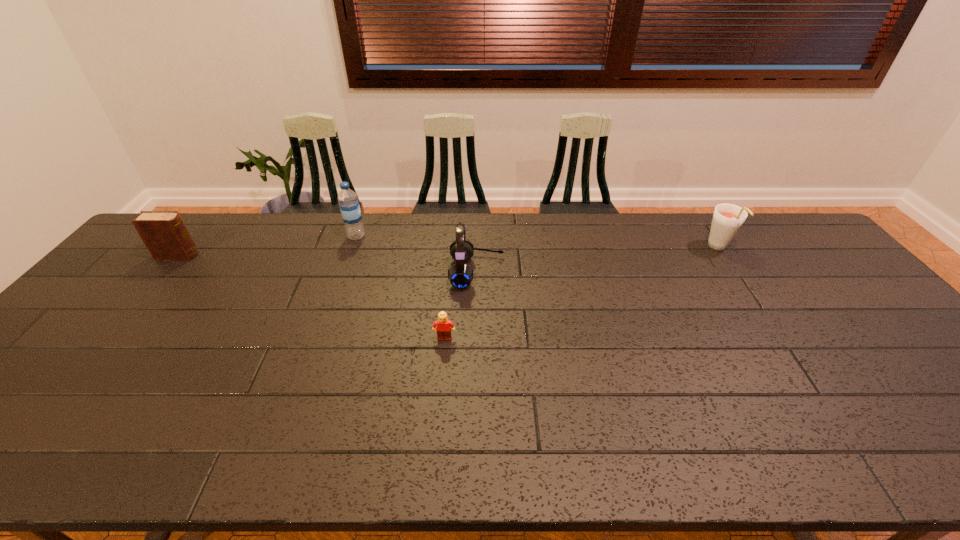
At what (x,y) coordinates should I click in order to perform the action: click on vacant space that is in between the diary and the water bottle. Please return your answer as a coordinate pair (x, y). Looking at the image, I should click on (267, 246).

This screenshot has height=540, width=960. Find the location of `free spot between the shortest object and the water bottle`. free spot between the shortest object and the water bottle is located at coordinates (400, 287).

Identify which object is the nearest to the tallest object. Please provide its 2D coordinates. Your answer should be formatted as a tuple, i.e. [(x, y)], where the tuple contains the x and y coordinates of a point satisfying the conditions above.

[(460, 275)]

Identify which object is the closest to the headset. Please provide its 2D coordinates. Your answer should be formatted as a tuple, i.e. [(x, y)], where the tuple contains the x and y coordinates of a point satisfying the conditions above.

[(444, 326)]

Find the location of a particular element. The image size is (960, 540). vacant space that satisfies the following two spatial constraints: 1. on the drink side of the root beer; 2. on the ear cushions of the headset is located at coordinates (735, 272).

Where is `free point that satisfies the following two spatial constraints: 1. on the drink side of the rightmost object; 2. on the ear cushions of the headset`? This screenshot has width=960, height=540. free point that satisfies the following two spatial constraints: 1. on the drink side of the rightmost object; 2. on the ear cushions of the headset is located at coordinates (735, 272).

Find the location of a particular element. free space that satisfies the following two spatial constraints: 1. on the ear cushions of the headset; 2. on the face of the Lego is located at coordinates [x=477, y=339].

Identify the location of vacant space that satisfies the following two spatial constraints: 1. on the ear cushions of the headset; 2. on the face of the Lego. (477, 339).

Where is `vacant region that satisfies the following two spatial constraints: 1. on the ear cushions of the headset; 2. on the face of the Lego`? The image size is (960, 540). vacant region that satisfies the following two spatial constraints: 1. on the ear cushions of the headset; 2. on the face of the Lego is located at coordinates (477, 339).